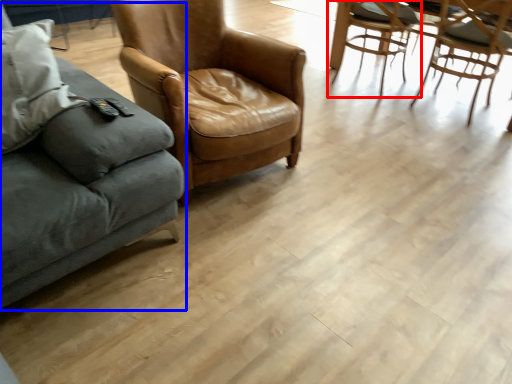
Question: Which point is further to the camera, chair (highlighted by a red box) or studio couch (highlighted by a blue box)?

Choices:
 (A) chair
 (B) studio couch

Answer: (A)